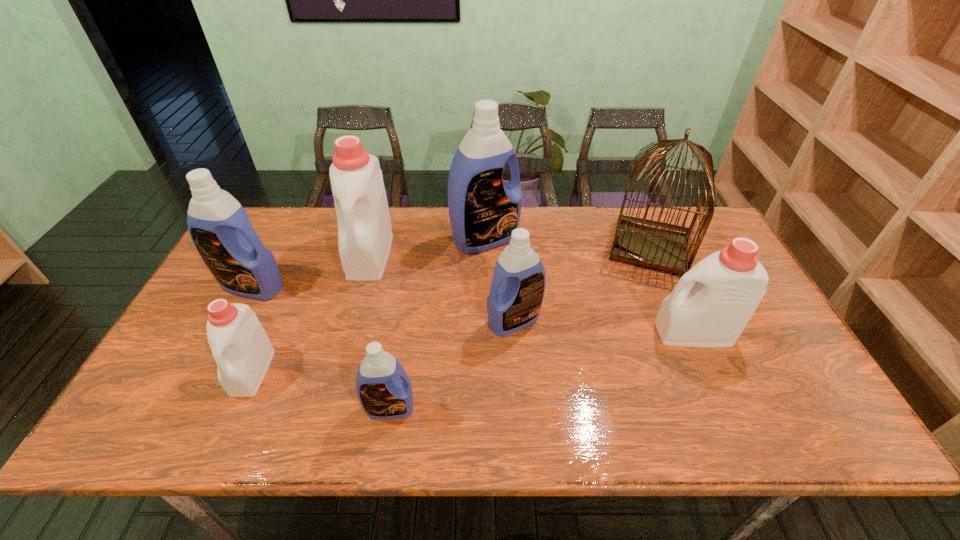
Find the location of a particular element. the leftmost white detergent is located at coordinates (240, 346).

Where is `the second blue detergent from left to right`? the second blue detergent from left to right is located at coordinates [383, 394].

You are a GUI agent. You are given a task and a screenshot of the screen. Output one action in this format:
    pyautogui.click(x=<x>, y=<y>)
    Task: Click on the fourth object from left to right
    The height and width of the screenshot is (540, 960).
    Given the screenshot: What is the action you would take?
    pyautogui.click(x=383, y=394)

The height and width of the screenshot is (540, 960). Find the location of `vacant space situated on the front of the biggest blue detergent`. vacant space situated on the front of the biggest blue detergent is located at coordinates (487, 348).

Locate an element on the screen. The image size is (960, 540). free space located 0.090m on the right of the birdcage is located at coordinates (723, 246).

This screenshot has height=540, width=960. Identify the location of free region located 0.380m on the right of the second biggest blue detergent. (417, 287).

Identify the location of blank space located on the handle side of the third detergent from left to right. The image size is (960, 540). coord(359,295).

The width and height of the screenshot is (960, 540). What are the coordinates of `free space located 0.190m on the left of the third farthest blue detergent` in the screenshot? It's located at (416, 320).

Find the location of `blank space located on the handle side of the second smallest white detergent`. blank space located on the handle side of the second smallest white detergent is located at coordinates (613, 333).

At what (x,y) coordinates should I click in order to perform the action: click on vacant space located on the handle side of the second smallest white detergent. Please return your answer as a coordinate pair (x, y). The image size is (960, 540). Looking at the image, I should click on (530, 333).